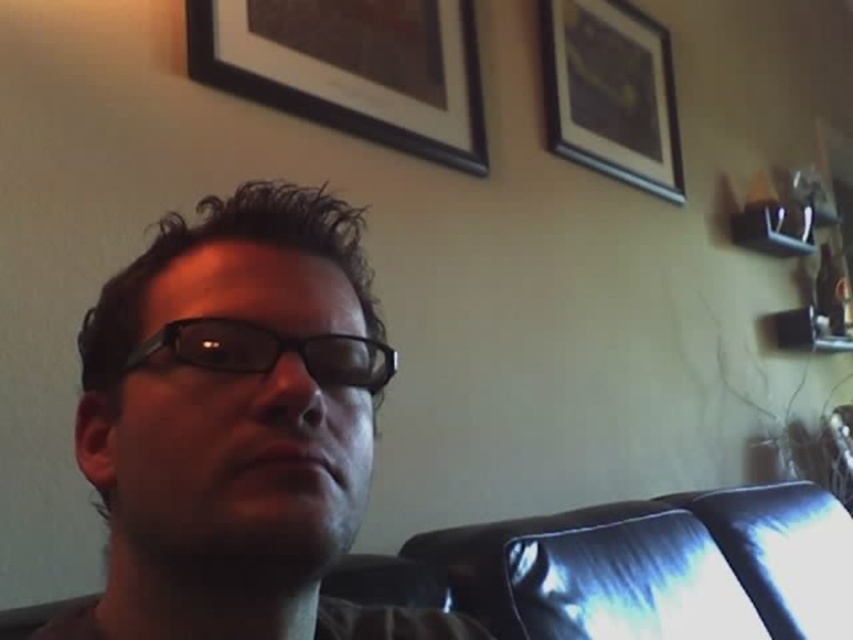
You are a photographer adjusting your camera to capture the person in the scene. The matte black glasses at center are positioned at coordinates 0.667 on the x and 0.279 on the y. To ensure the glasses are in focus, should you adjust your focus point to the left or right of their current position?

The matte black glasses at center are already at the specified coordinates, so no adjustment is needed. Keep the focus point where it is.

Consider the image. You are standing in the living room and want to clean the black matte picture frame at upper center. If your arm can reach up to 1.2 meters, can you reach it without a stool?

The black matte picture frame at upper center is 1.24 meters away from the viewer. Since your arm can only reach up to 1.2 meters, you cannot reach the black matte picture frame at upper center without a stool.

You are a photographer trying to capture a clear shot of the matte black glasses at center and the wooden picture frame at upper center. Since the glasses are in front of the frame, how should you position your camera to ensure both are visible without one blocking the other?

The matte black glasses at center are in front of the wooden picture frame at upper center. To capture both clearly, position the camera so it can see the glasses while angling slightly to include the frame behind them, ensuring neither blocks the other.